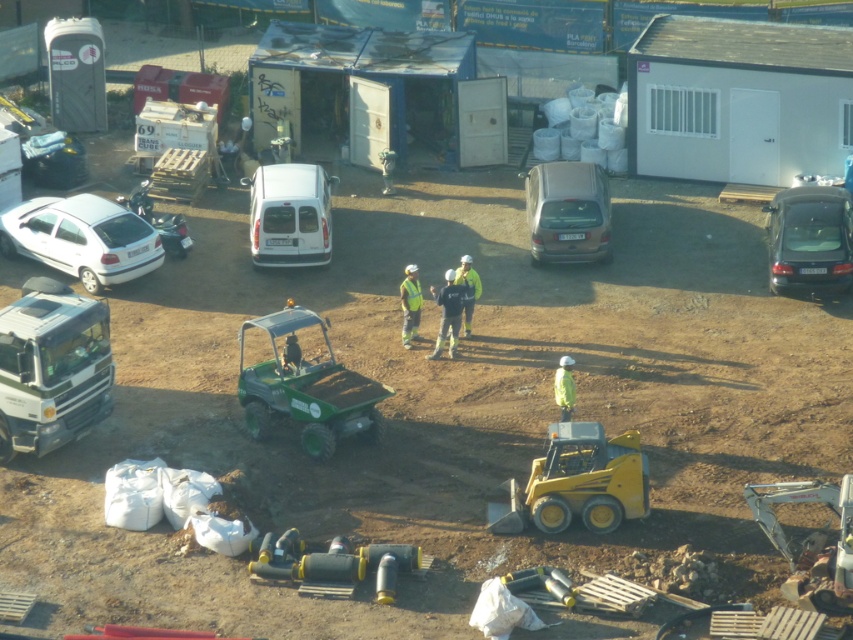
Who is higher up, metallic silver van at left or high visibility fabric safety vest at center?

Positioned higher is metallic silver van at left.

Is metallic silver van at left to the left of high visibility fabric safety vest at center from the viewer's perspective?

Yes, metallic silver van at left is to the left of high visibility fabric safety vest at center.

Does point (76, 166) come closer to viewer compared to point (416, 266)?

No, (76, 166) is further to viewer.

Find the location of a particular element. metallic silver van at left is located at coordinates (54, 160).

Does satin gold car at center have a greater width compared to reflective yellow safety vest at center?

Yes, satin gold car at center is wider than reflective yellow safety vest at center.

Can you confirm if satin gold car at center is positioned above reflective yellow safety vest at center?

Correct, satin gold car at center is located above reflective yellow safety vest at center.

Which is in front, point (560, 208) or point (405, 289)?

Point (405, 289) is in front.

Locate an element on the screen. Image resolution: width=853 pixels, height=640 pixels. satin gold car at center is located at coordinates (567, 212).

Is shiny black sedan at right above reflective yellow safety vest at center?

Yes.

Is shiny black sedan at right to the left of reflective yellow safety vest at center from the viewer's perspective?

In fact, shiny black sedan at right is to the right of reflective yellow safety vest at center.

Between point (839, 216) and point (416, 291), which one is positioned behind?

The point (839, 216) is behind.

Locate an element on the screen. The image size is (853, 640). shiny black sedan at right is located at coordinates (809, 237).